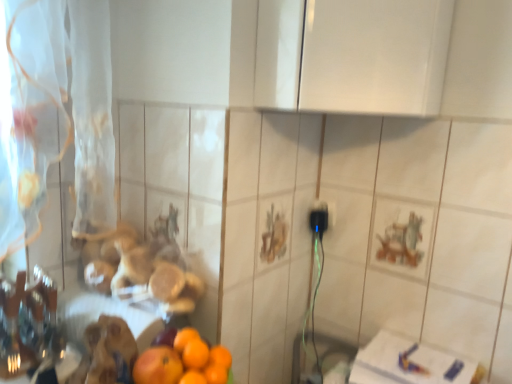
Question: From a real-world perspective, is white sheer curtain at left under orange matte at lower left, marked as the second orange in a left-to-right arrangement?

Choices:
 (A) no
 (B) yes

Answer: (A)

Question: Is white sheer curtain at left not inside orange matte at lower left, the first orange viewed from the right?

Choices:
 (A) no
 (B) yes

Answer: (B)

Question: Can you confirm if white sheer curtain at left is taller than orange matte at lower left, the first orange viewed from the right?

Choices:
 (A) no
 (B) yes

Answer: (B)

Question: Is white sheer curtain at left further to camera compared to orange matte at lower left, marked as the second orange in a left-to-right arrangement?

Choices:
 (A) yes
 (B) no

Answer: (B)

Question: Is white sheer curtain at left closer to the viewer compared to orange matte at lower left, the first orange viewed from the right?

Choices:
 (A) yes
 (B) no

Answer: (A)

Question: From a real-world perspective, relative to orange matte at lower left, the first orange viewed from the right, is white sheer curtain at left vertically above or below?

Choices:
 (A) below
 (B) above

Answer: (B)

Question: In terms of height, does white sheer curtain at left look taller or shorter compared to orange matte at lower left, the first orange viewed from the right?

Choices:
 (A) tall
 (B) short

Answer: (A)

Question: Is white sheer curtain at left bigger or smaller than orange matte at lower left, the first orange viewed from the right?

Choices:
 (A) big
 (B) small

Answer: (A)

Question: Does point (84, 77) appear closer or farther from the camera than point (194, 354)?

Choices:
 (A) closer
 (B) farther

Answer: (B)

Question: In terms of size, does orange matte at lower left, marked as the second orange in a left-to-right arrangement, appear bigger or smaller than white sheer curtain at left?

Choices:
 (A) small
 (B) big

Answer: (A)

Question: Looking at their shapes, would you say orange matte at lower left, the first orange viewed from the right, is wider or thinner than white sheer curtain at left?

Choices:
 (A) thin
 (B) wide

Answer: (A)

Question: From the image's perspective, is orange matte at lower left, marked as the second orange in a left-to-right arrangement, above or below white sheer curtain at left?

Choices:
 (A) above
 (B) below

Answer: (B)

Question: In the image, is orange matte at lower left, marked as the second orange in a left-to-right arrangement, positioned in front of or behind white sheer curtain at left?

Choices:
 (A) front
 (B) behind

Answer: (B)

Question: Is orange matte at lower left, arranged as the 2th orange when viewed from the right, inside the boundaries of white sheer curtain at left, or outside?

Choices:
 (A) outside
 (B) inside

Answer: (A)

Question: From a real-world perspective, is orange matte at lower left, acting as the 1th orange starting from the left, above or below white sheer curtain at left?

Choices:
 (A) below
 (B) above

Answer: (A)